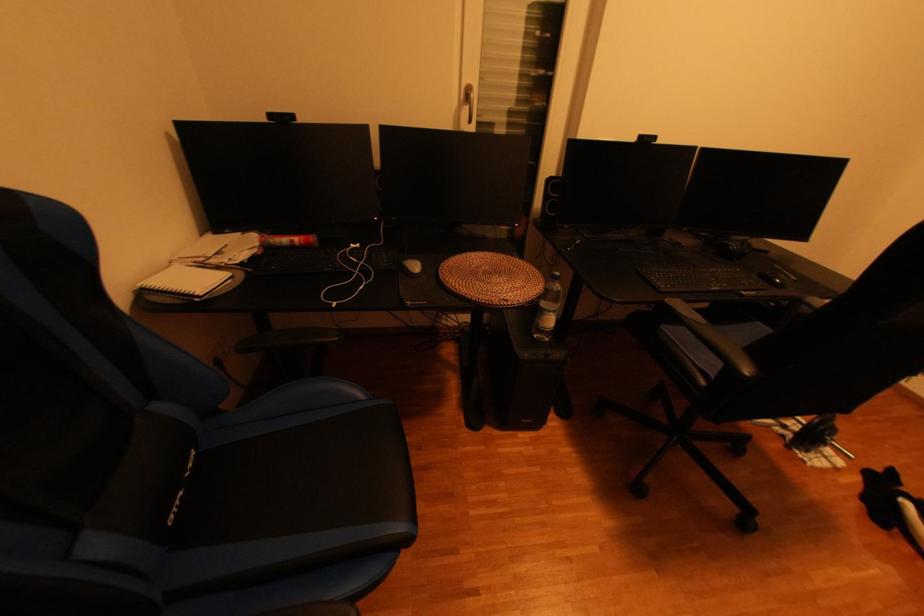
Image resolution: width=924 pixels, height=616 pixels. Find the location of `black chair sitting surface`. black chair sitting surface is located at coordinates (280, 469).